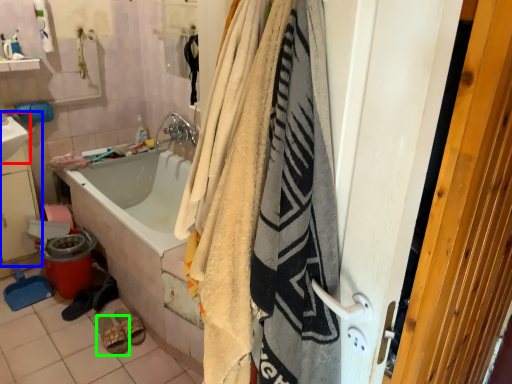
Question: Which object is positioned closest to sink (highlighted by a red box)? Select from sink (highlighted by a blue box) and footwear (highlighted by a green box).

Choices:
 (A) sink
 (B) footwear

Answer: (A)